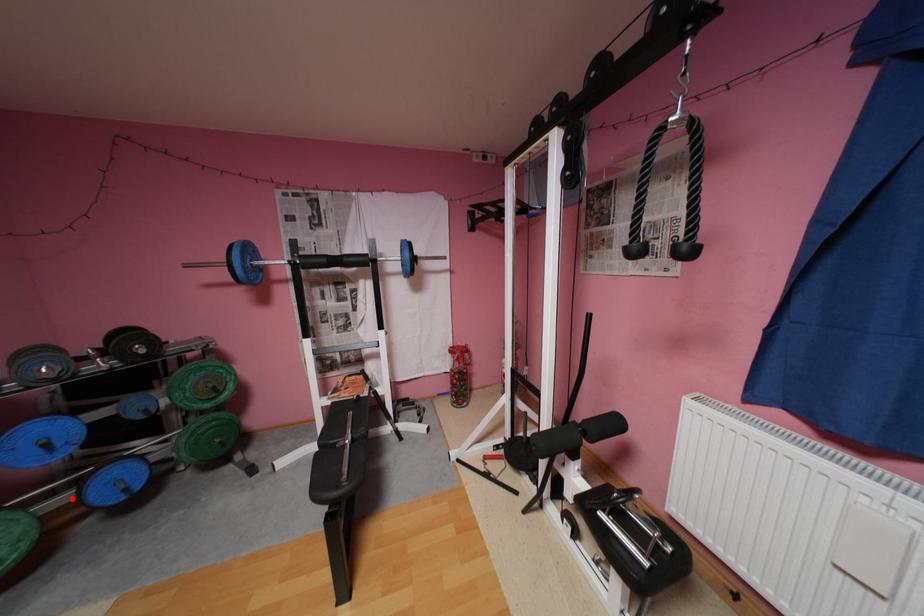
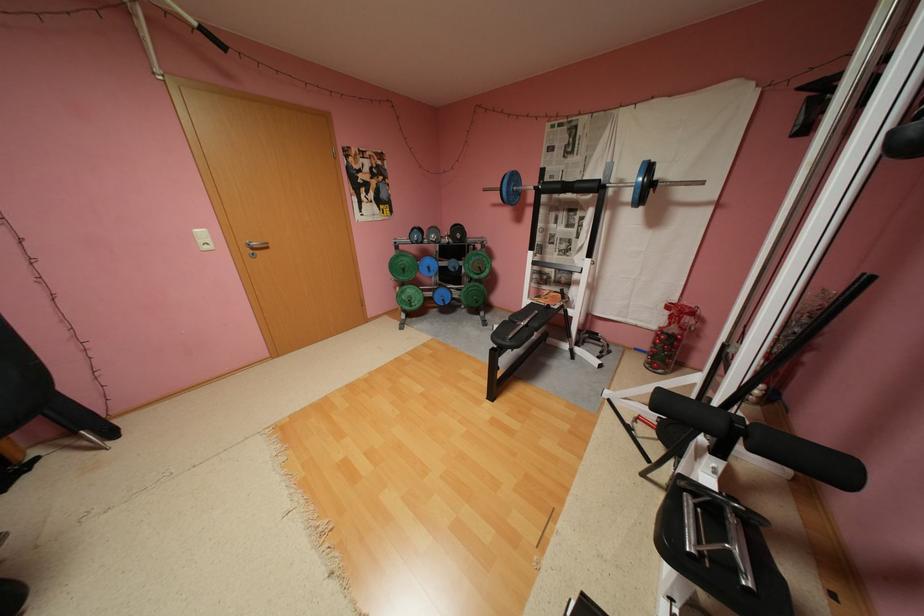
The point at the highlighted location is marked in the first image. Where is the corresponding point in the second image?

(439, 294)